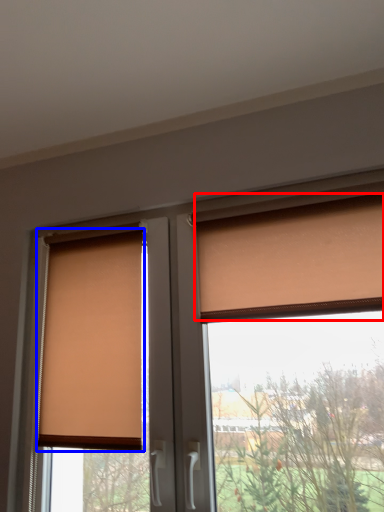
Question: Which point is further to the camera, curtain (highlighted by a red box) or window blind (highlighted by a blue box)?

Choices:
 (A) curtain
 (B) window blind

Answer: (B)